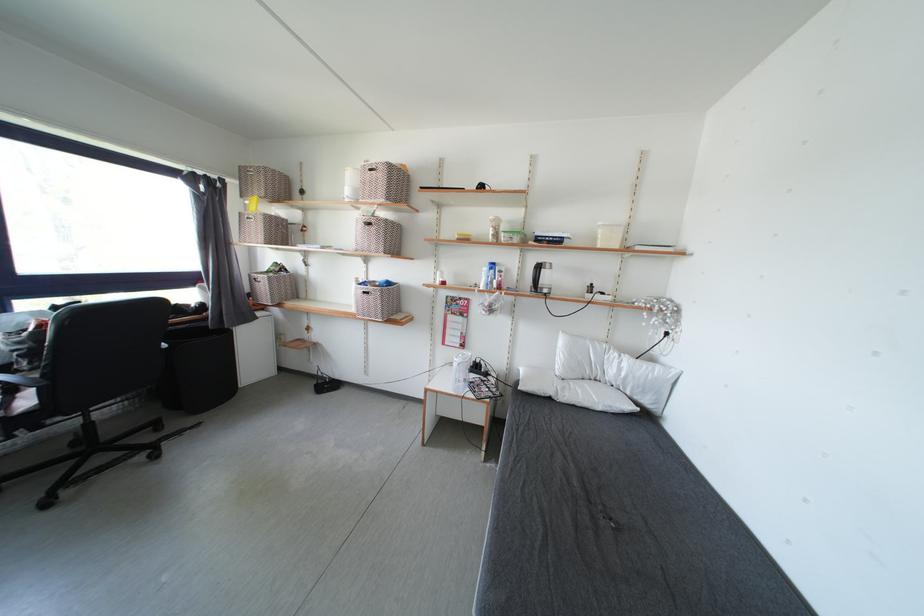
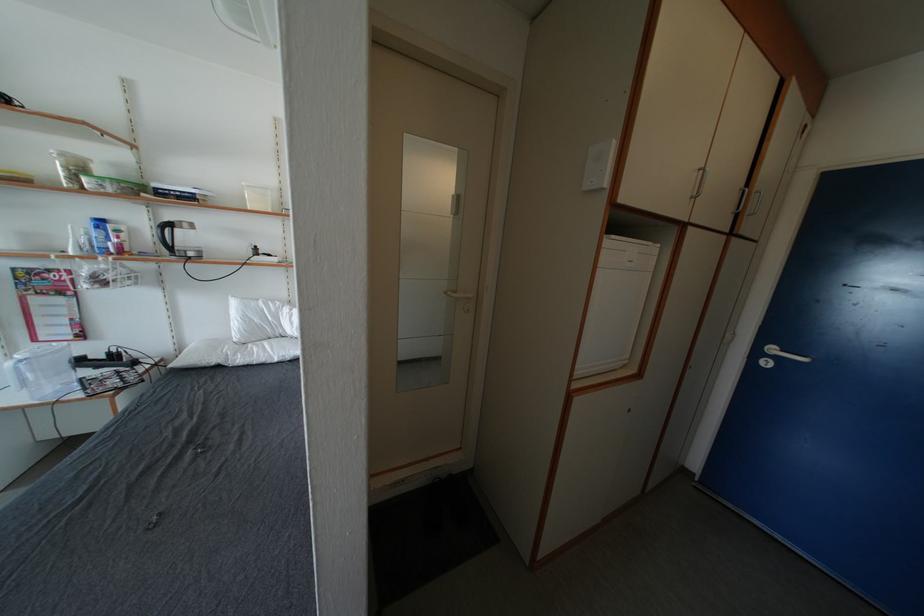
Find the pixel in the second image that matches point (497, 274) in the first image.

(103, 232)